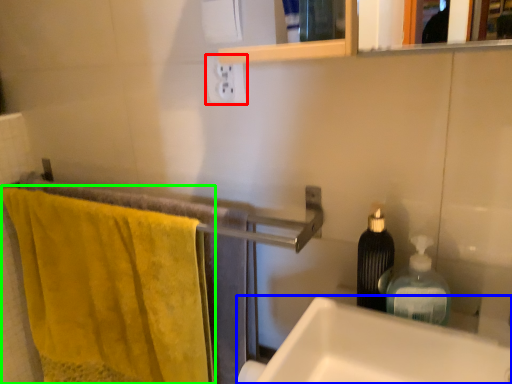
Question: Based on their relative distances, which object is farther from electric outlet (highlighted by a red box)? Choose from sink (highlighted by a blue box) and bath towel (highlighted by a green box).

Choices:
 (A) sink
 (B) bath towel

Answer: (B)